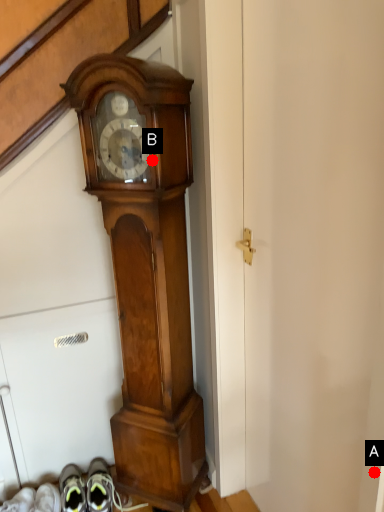
Question: Two points are circled on the image, labeled by A and B beside each circle. Which point is closer to the camera taking this photo?

Choices:
 (A) A is closer
 (B) B is closer

Answer: (A)